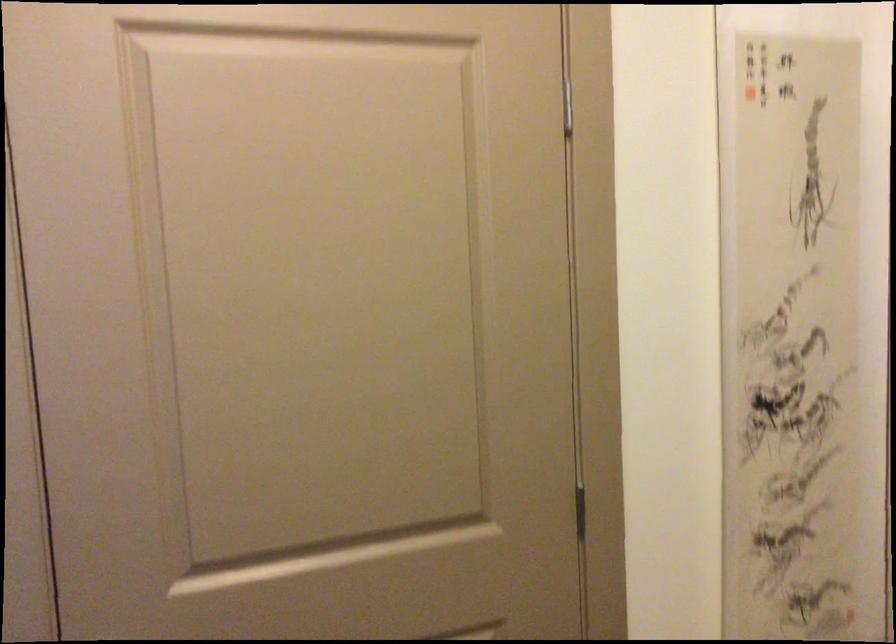
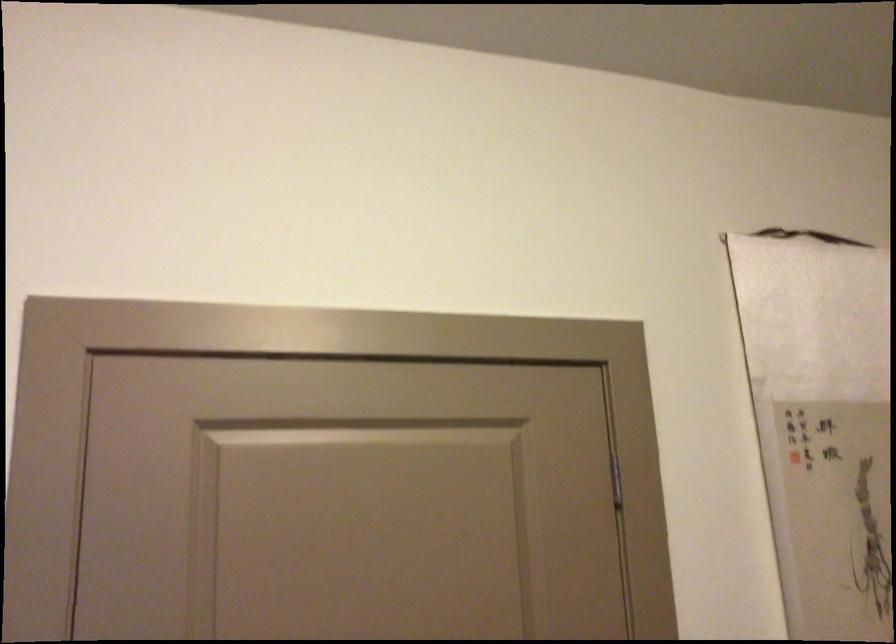
Consider the image. Which direction would the cameraman need to move to produce the second image?

The cameraman walked toward left, backward.